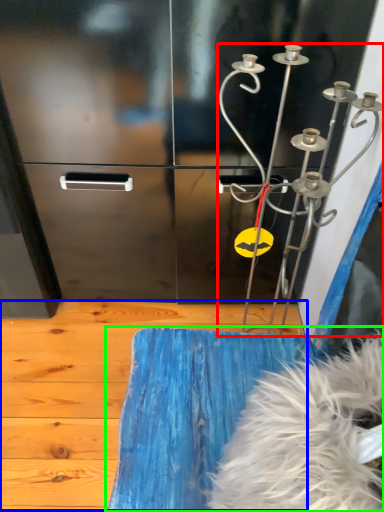
Question: Considering the real-world distances, which object is closest to wind chime (highlighted by a red box)? plywood (highlighted by a blue box) or furniture (highlighted by a green box).

Choices:
 (A) plywood
 (B) furniture

Answer: (B)